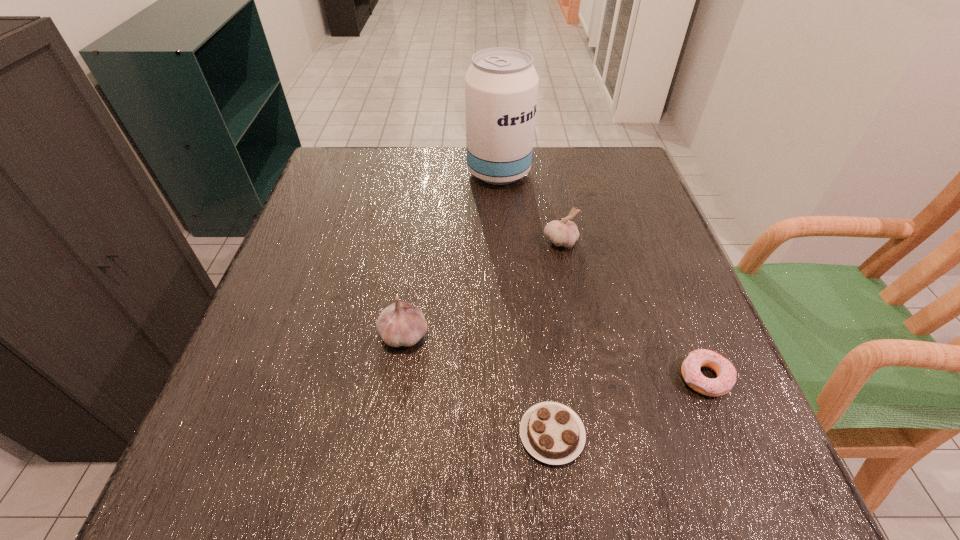
Find the location of `vacant position at the right edge of the desktop`. vacant position at the right edge of the desktop is located at coordinates (683, 289).

Identify the location of vacant space at the far right corner of the desktop. Image resolution: width=960 pixels, height=540 pixels. pyautogui.click(x=598, y=190).

Identify the location of vacant area that lies between the nearer garlic and the doughnut. (554, 356).

Where is `vacant point located between the alcohol and the shorter garlic`? vacant point located between the alcohol and the shorter garlic is located at coordinates (529, 207).

Where is `unoccupied area between the doughnut and the third nearest object`? The height and width of the screenshot is (540, 960). unoccupied area between the doughnut and the third nearest object is located at coordinates (554, 356).

Where is `free space between the chocolate cake and the doughnut`? This screenshot has width=960, height=540. free space between the chocolate cake and the doughnut is located at coordinates (629, 406).

Locate an element on the screen. empty space between the right garlic and the left garlic is located at coordinates (482, 288).

You are a GUI agent. You are given a task and a screenshot of the screen. Output one action in this format:
    pyautogui.click(x=<x>, y=<y>)
    Task: Click on the vacant area between the chocolate cake and the fourth nearest object
    
    Given the screenshot: What is the action you would take?
    pyautogui.click(x=556, y=338)

Identify the location of vacant area that lies between the alcohol and the left garlic. (451, 253).

Find the location of a particular element. unoccupied position between the right garlic and the farthest object is located at coordinates (529, 207).